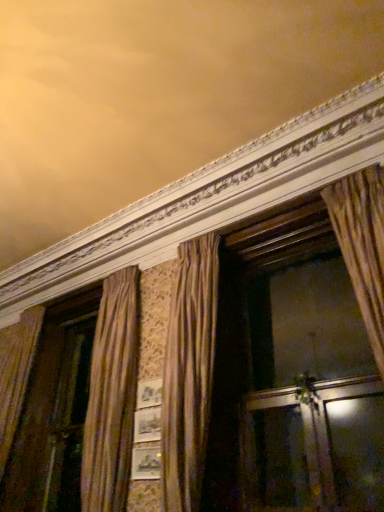
What do you see at coordinates (189, 373) in the screenshot?
I see `gold textured curtain at center` at bounding box center [189, 373].

Locate an element on the screen. This screenshot has height=512, width=384. gold textured curtain at center is located at coordinates (189, 373).

Image resolution: width=384 pixels, height=512 pixels. I want to click on transparent glass screen door at lower right, so click(x=357, y=451).

Measure the distance between transparent glass screen door at lower right and camera.

transparent glass screen door at lower right and camera are 8.09 feet apart from each other.

The image size is (384, 512). What do you see at coordinates (357, 451) in the screenshot? I see `transparent glass screen door at lower right` at bounding box center [357, 451].

You are a GUI agent. You are given a task and a screenshot of the screen. Output one action in this format:
    pyautogui.click(x=<x>, y=<y>)
    Task: Click on the gold textured curtain at center
    Image resolution: width=384 pixels, height=512 pixels.
    Given the screenshot: What is the action you would take?
    pyautogui.click(x=189, y=373)

Is gold textured curtain at center to the left or to the right of transparent glass screen door at lower right in the image?

Clearly, gold textured curtain at center is on the left of transparent glass screen door at lower right in the image.

Between gold textured curtain at center and transparent glass screen door at lower right, which one is positioned in front?

transparent glass screen door at lower right.

Considering the points (176, 477) and (332, 415), which point is behind, point (176, 477) or point (332, 415)?

The point (332, 415) is farther from the camera.

From the picture: From the image's perspective, between gold textured curtain at center and transparent glass screen door at lower right, who is located below?

transparent glass screen door at lower right.

From a real-world perspective, who is located lower, gold textured curtain at center or transparent glass screen door at lower right?

transparent glass screen door at lower right, from a real-world perspective.

Does gold textured curtain at center have a lesser width compared to transparent glass screen door at lower right?

Incorrect, the width of gold textured curtain at center is not less than that of transparent glass screen door at lower right.

Is gold textured curtain at center taller than transparent glass screen door at lower right?

Yes, gold textured curtain at center is taller than transparent glass screen door at lower right.

Can you confirm if gold textured curtain at center is bigger than transparent glass screen door at lower right?

Yes, gold textured curtain at center is bigger than transparent glass screen door at lower right.

Is gold textured curtain at center situated inside transparent glass screen door at lower right or outside?

gold textured curtain at center is not enclosed by transparent glass screen door at lower right.

Would you say gold textured curtain at center is a long distance from transparent glass screen door at lower right?

gold textured curtain at center is far away from transparent glass screen door at lower right.

Does gold textured curtain at center turn towards transparent glass screen door at lower right?

No, gold textured curtain at center is not turned towards transparent glass screen door at lower right.

What's the angular difference between gold textured curtain at center and transparent glass screen door at lower right's facing directions?

There is a 3.94-degree angle between the facing directions of gold textured curtain at center and transparent glass screen door at lower right.

Could you measure the distance between gold textured curtain at center and transparent glass screen door at lower right?

gold textured curtain at center and transparent glass screen door at lower right are 1.08 meters apart from each other.

Identify the location of curtain behind the transparent glass screen door at lower right. The height and width of the screenshot is (512, 384). [x=189, y=373].

Is transparent glass screen door at lower right to the left or to the right of gold textured curtain at center in the image?

transparent glass screen door at lower right is positioned on gold textured curtain at center's right side.

Who is more distant, transparent glass screen door at lower right or gold textured curtain at center?

gold textured curtain at center.

Is point (345, 463) closer or farther from the camera than point (195, 470)?

Clearly, point (345, 463) is closer to the camera than point (195, 470).

From the image's perspective, is transparent glass screen door at lower right above gold textured curtain at center?

No, from the image's perspective, transparent glass screen door at lower right is not over gold textured curtain at center.

From a real-world perspective, which is physically below, transparent glass screen door at lower right or gold textured curtain at center?

transparent glass screen door at lower right is physically lower.

Which of these two, transparent glass screen door at lower right or gold textured curtain at center, is thinner?

transparent glass screen door at lower right.

Between transparent glass screen door at lower right and gold textured curtain at center, which one has more height?

With more height is gold textured curtain at center.

Considering the sizes of objects transparent glass screen door at lower right and gold textured curtain at center in the image provided, who is smaller, transparent glass screen door at lower right or gold textured curtain at center?

With smaller size is transparent glass screen door at lower right.

Would you say gold textured curtain at center is part of transparent glass screen door at lower right's contents?

No, gold textured curtain at center is located outside of transparent glass screen door at lower right.

Is there a large distance between transparent glass screen door at lower right and gold textured curtain at center?

transparent glass screen door at lower right is far away from gold textured curtain at center.

From the picture: Is transparent glass screen door at lower right turned away from gold textured curtain at center?

No, transparent glass screen door at lower right's orientation is not away from gold textured curtain at center.

Can you tell me how much transparent glass screen door at lower right and gold textured curtain at center differ in facing direction?

The angle between the facing direction of transparent glass screen door at lower right and the facing direction of gold textured curtain at center is 3.94 degrees.

Find the location of a particular element. curtain on the left of transparent glass screen door at lower right is located at coordinates tap(189, 373).

This screenshot has height=512, width=384. What are the coordinates of `curtain that appears behind the transparent glass screen door at lower right` in the screenshot? It's located at (189, 373).

Locate an element on the screen. The image size is (384, 512). screen door below the gold textured curtain at center (from the image's perspective) is located at coordinates (357, 451).